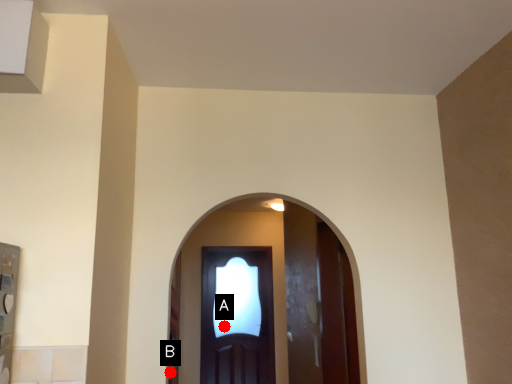
Question: Two points are circled on the image, labeled by A and B beside each circle. Which point is farther from the camera taking this photo?

Choices:
 (A) A is further
 (B) B is further

Answer: (A)